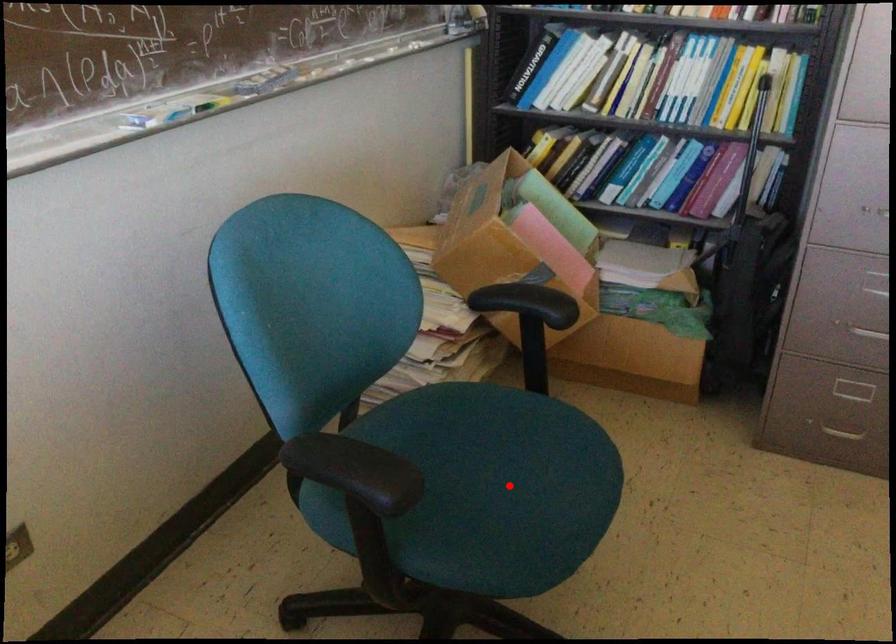
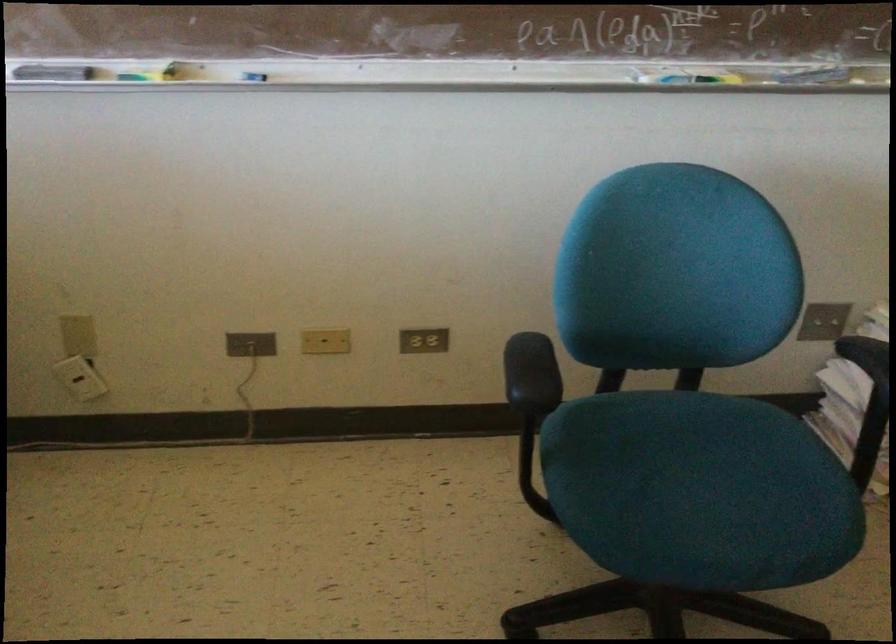
Find the pixel in the second image that matches the highlighted location in the first image.

(700, 491)